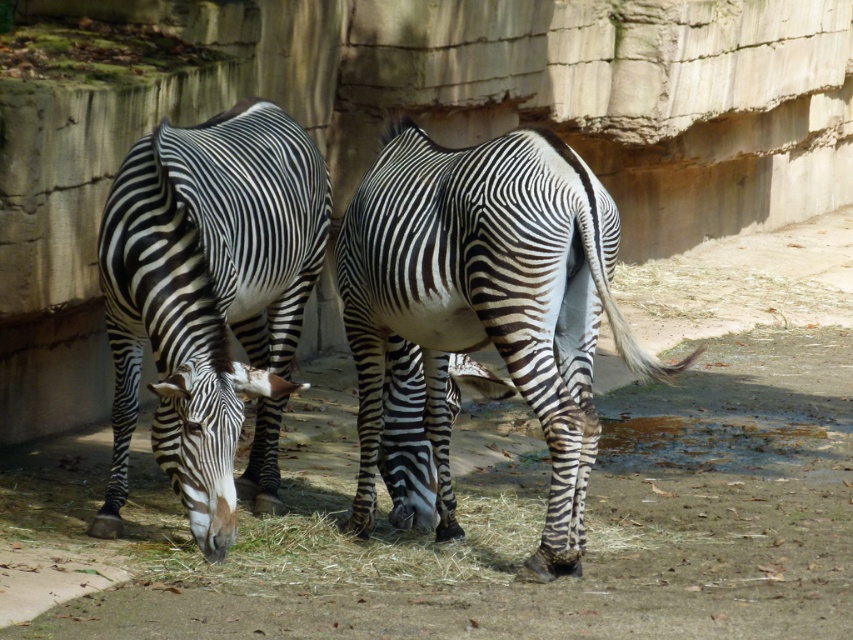
Between point (505, 141) and point (225, 152), which one is positioned in front?

Positioned in front is point (505, 141).

Is the position of black and white striped zebra at center more distant than that of black and white striped zebra at left?

No, it is not.

Is point (486, 227) behind point (274, 122)?

No, it is not.

Locate an element on the screen. The width and height of the screenshot is (853, 640). black and white striped zebra at center is located at coordinates pos(486,300).